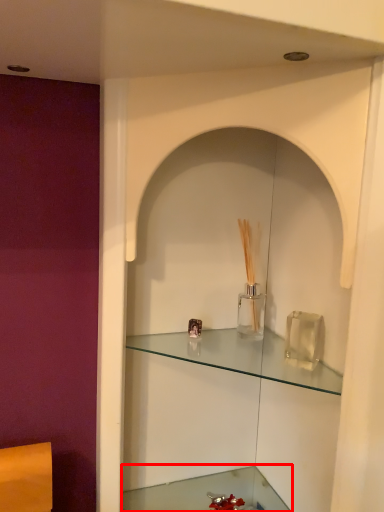
Question: In this image, where is cabinetry (annotated by the red box) located relative to shelf?

Choices:
 (A) left
 (B) right

Answer: (A)